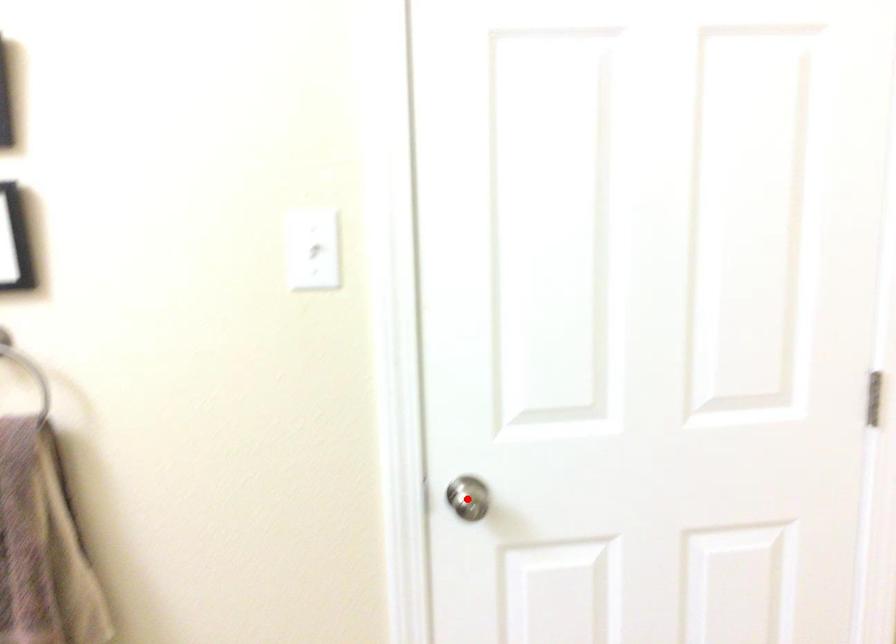
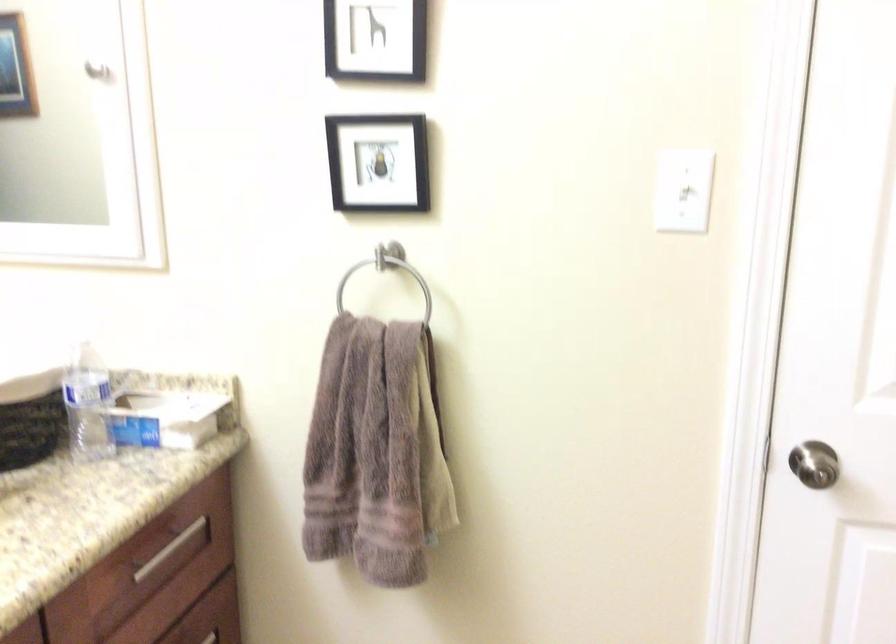
Where in the second image is the point corresponding to the highlighted location from the first image?

(814, 464)